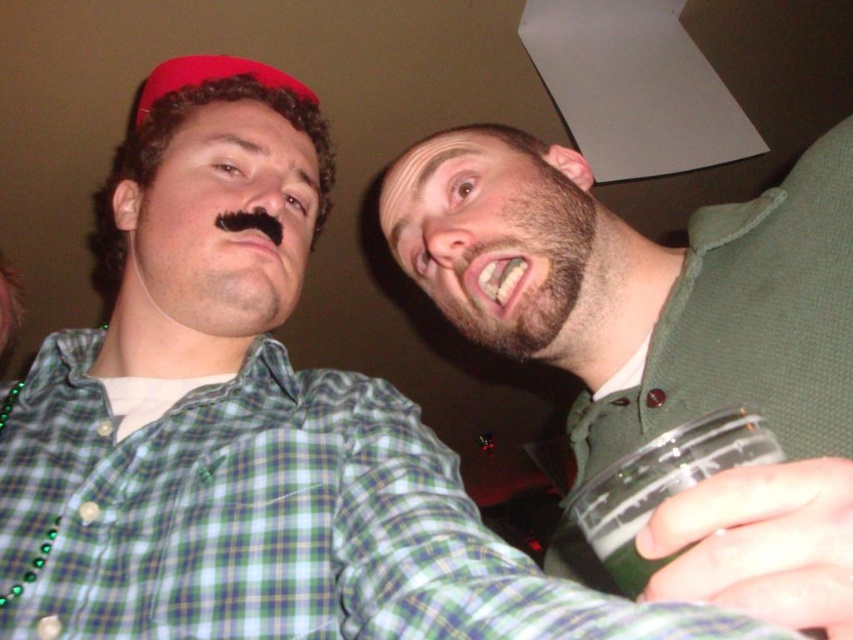
Does point (471, 250) come farther from viewer compared to point (569, 508)?

Yes.

Which is more to the left, dark brown stubble at upper right or green frothy liquid at lower right?

dark brown stubble at upper right is more to the left.

At what (x,y) coordinates should I click in order to perform the action: click on dark brown stubble at upper right. Please return your answer as a coordinate pair (x, y). This screenshot has height=640, width=853. Looking at the image, I should click on (523, 262).

Who is more forward, (628, 244) or (532, 166)?

Point (628, 244)

Who is higher up, green matte cup at right or dark brown stubble at upper right?

dark brown stubble at upper right

Who is more distant from viewer, (511, 224) or (519, 209)?

The point (519, 209) is behind.

Find the location of a particular element. This screenshot has width=853, height=640. green matte cup at right is located at coordinates (665, 342).

Who is taller, green matte cup at right or green frothy liquid at lower right?

Standing taller between the two is green matte cup at right.

Is green matte cup at right taller than green frothy liquid at lower right?

Indeed, green matte cup at right has a greater height compared to green frothy liquid at lower right.

Who is more distant from viewer, (668, 532) or (610, 480)?

The point (610, 480) is behind.

Identify the location of green matte cup at right. The height and width of the screenshot is (640, 853). (665, 342).